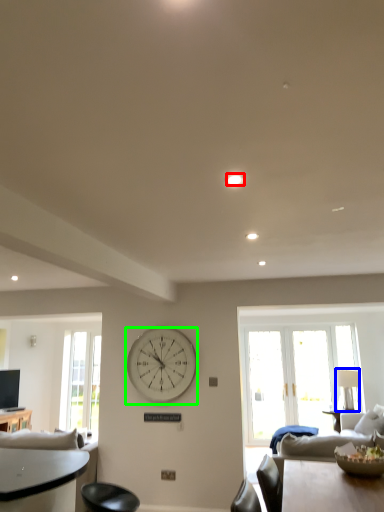
Question: Based on their relative distances, which object is farther from light (highlighted by a red box)? Choose from lamp (highlighted by a blue box) and wall clock (highlighted by a green box).

Choices:
 (A) lamp
 (B) wall clock

Answer: (A)